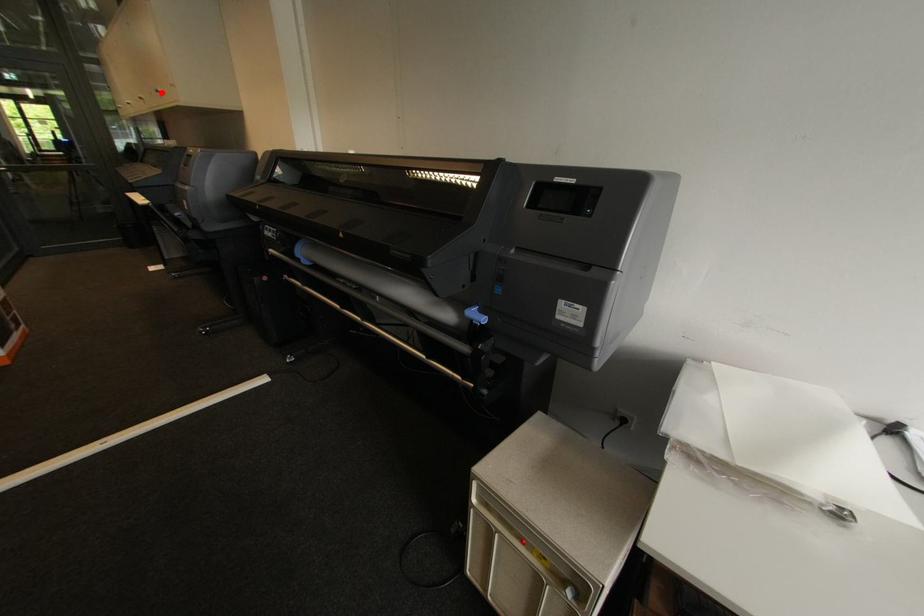
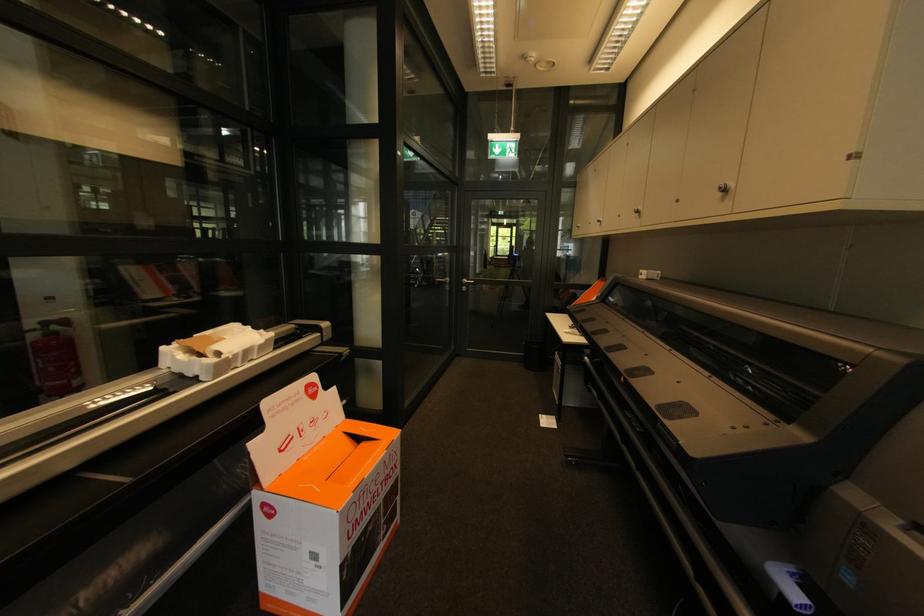
In the second image, find the point that corresponds to the highlighted location in the first image.

(727, 191)